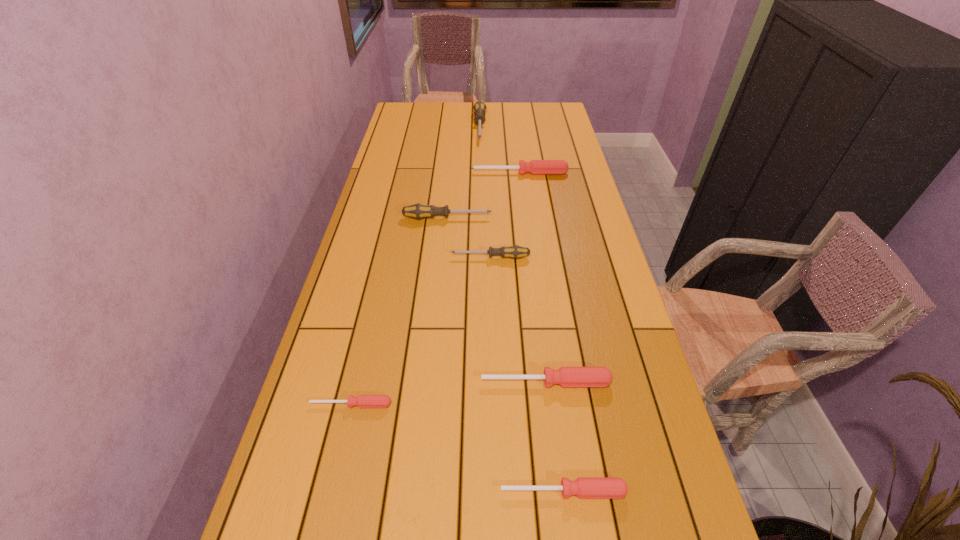
Where is `free space located on the right of the third nearest screwdriver`? free space located on the right of the third nearest screwdriver is located at coordinates (654, 382).

The height and width of the screenshot is (540, 960). Find the location of `blank area located 0.380m on the left of the sixth tallest object`. blank area located 0.380m on the left of the sixth tallest object is located at coordinates (303, 491).

Locate an element on the screen. free region located 0.060m on the back of the shortest object is located at coordinates (357, 376).

Find the location of a particular element. This screenshot has width=960, height=540. object present at the far edge is located at coordinates [479, 108].

In the image, there is a desktop. Find the location of `vacant region at the far edge`. vacant region at the far edge is located at coordinates (524, 115).

This screenshot has width=960, height=540. Find the location of `vacant area at the left edge`. vacant area at the left edge is located at coordinates pos(361,232).

The width and height of the screenshot is (960, 540). What are the coordinates of `free space at the right edge of the desktop` in the screenshot? It's located at (664, 419).

You are a GUI agent. You are given a task and a screenshot of the screen. Output one action in this format:
    pyautogui.click(x=<x>, y=<y>)
    Task: Click on the vacant area at the far right corner
    The image size is (960, 540).
    Given the screenshot: What is the action you would take?
    pyautogui.click(x=559, y=116)

Identify the location of free space between the farthest object and the sixth tallest object. This screenshot has width=960, height=540. tap(521, 309).

Find the location of a particular element. empty space between the smallest gray screwdriver and the second biggest red screwdriver is located at coordinates (518, 320).